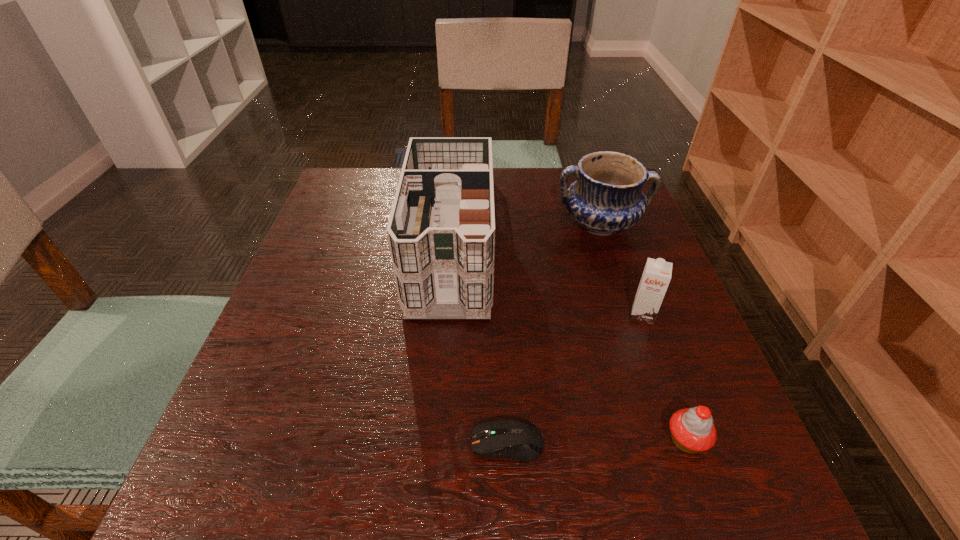
Locate an element on the screen. free space that satisfies the following two spatial constraints: 1. on the front side of the third shortest object; 2. on the button of the computer equipment is located at coordinates (689, 443).

Where is `vacant position in the image that satisfies the following two spatial constraints: 1. on the front side of the pottery; 2. on the button of the shortest object`? vacant position in the image that satisfies the following two spatial constraints: 1. on the front side of the pottery; 2. on the button of the shortest object is located at coordinates (673, 443).

Identify the location of free point that satisfies the following two spatial constraints: 1. on the front side of the fourth shortest object; 2. on the button of the shortest object. The height and width of the screenshot is (540, 960). (673, 443).